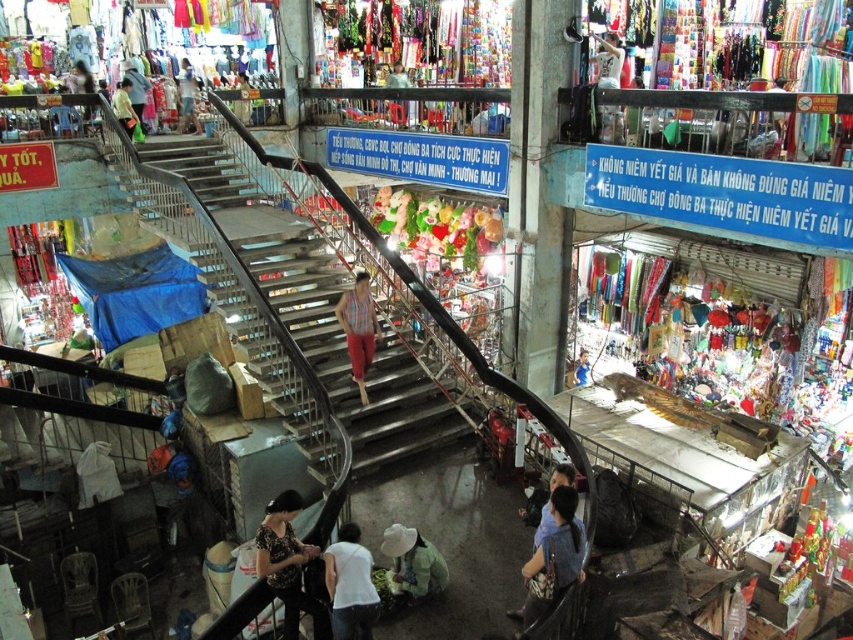
Question: Where is green fabric hat at lower center located in relation to matte black shirt at lower center in the image?

Choices:
 (A) left
 (B) right

Answer: (A)

Question: Which is farther from the light blue fabric at upper center?

Choices:
 (A) metallic staircase at center
 (B) matte black shirt at lower center
 (C) white plastic bag at upper right
 (D) green fabric hat at lower center

Answer: (B)

Question: Can you confirm if metallic staircase at center is positioned above light blue fabric at upper center?

Choices:
 (A) yes
 (B) no

Answer: (B)

Question: Which object appears closest to the camera in this image?

Choices:
 (A) green fabric hat at lower center
 (B) striped fabric pants at center

Answer: (A)

Question: Is green fabric hat at lower center to the left of white plastic bag at upper right from the viewer's perspective?

Choices:
 (A) no
 (B) yes

Answer: (B)

Question: Estimate the real-world distances between objects in this image. Which object is closer to the denim jacket at lower right?

Choices:
 (A) matte black shirt at lower center
 (B) metallic staircase at center
 (C) white matte shirt at lower center

Answer: (A)